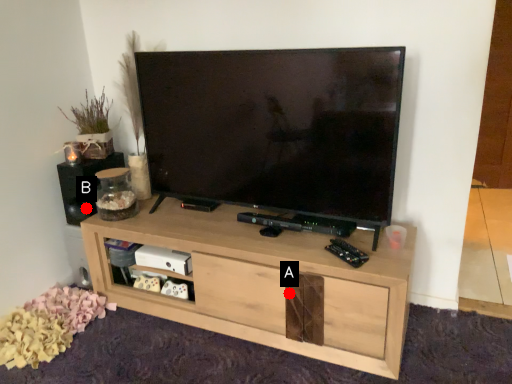
Question: Two points are circled on the image, labeled by A and B beside each circle. Which point is farther to the camera?

Choices:
 (A) A is further
 (B) B is further

Answer: (B)